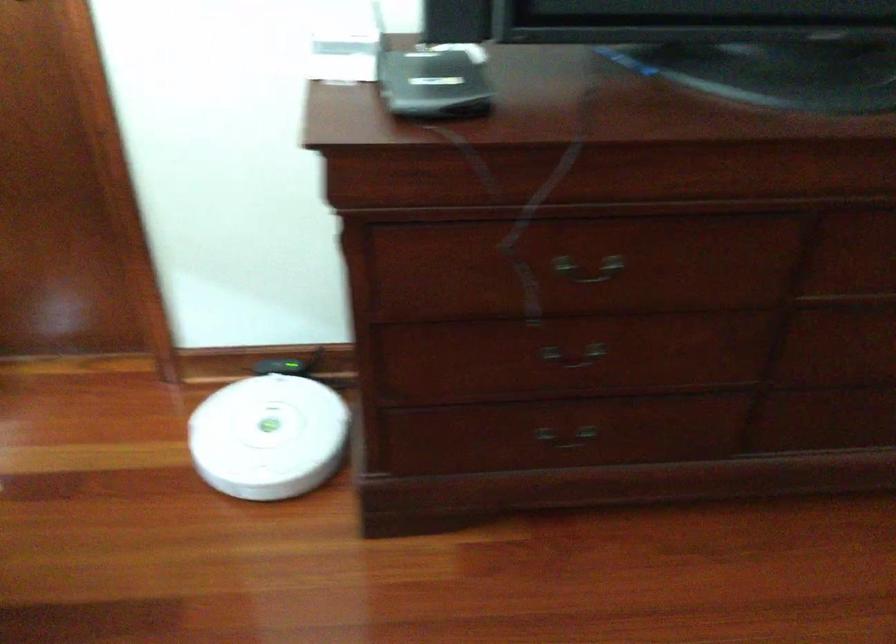
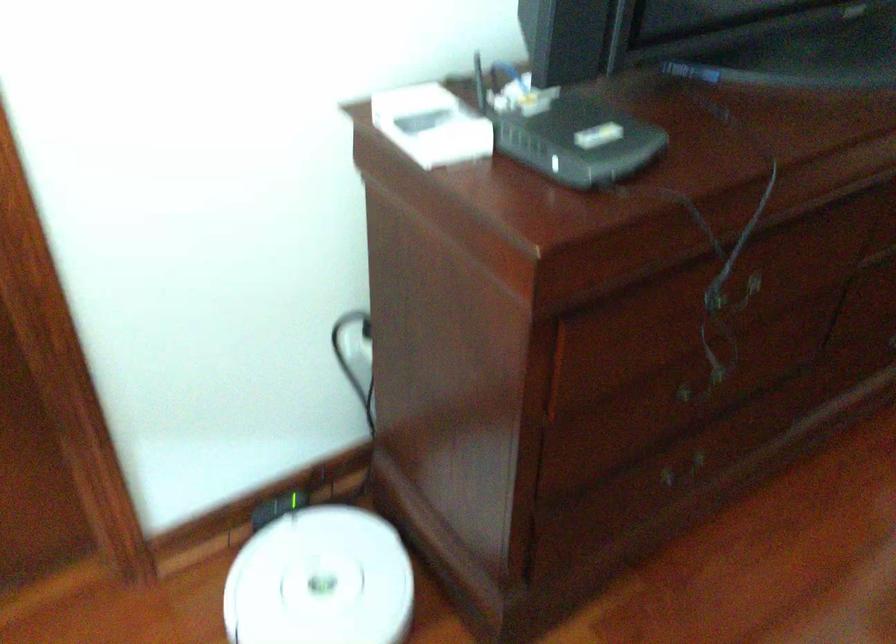
Locate, in the second image, the point that corresponds to point (270, 426) in the first image.

(321, 581)